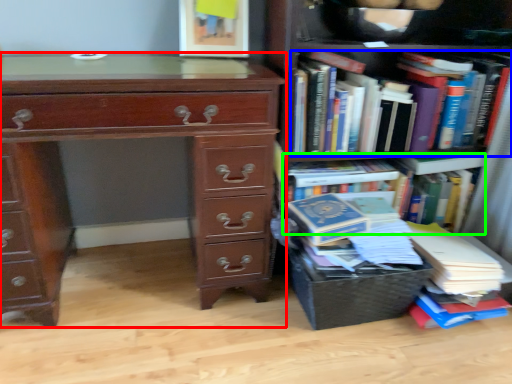
Question: Which object is positioned farthest from chest of drawers (highlighted by a red box)? Select from book (highlighted by a blue box) and book (highlighted by a green box).

Choices:
 (A) book
 (B) book

Answer: (B)